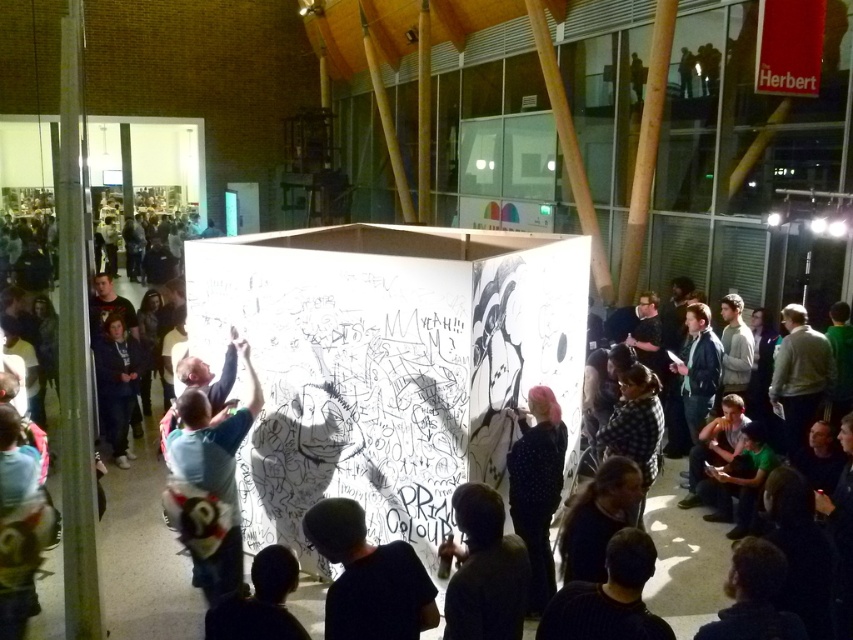
From the picture: You are a photographer trying to capture a candid shot of the dark blue shirt at center and the dark blue hoodie at center. Since you want to ensure both are fully visible in the frame, which person should you position closer to the camera to avoid being blocked by the other?

The dark blue shirt at center is not as tall as the dark blue hoodie at center, so you should position the dark blue shirt at center closer to the camera to prevent the taller dark blue hoodie at center from blocking it.